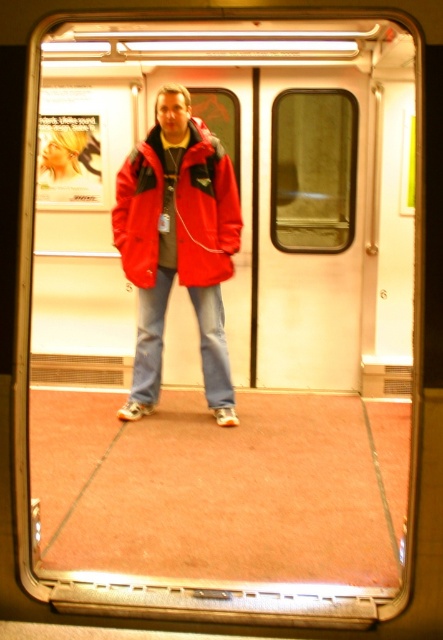
You are a passenger on the subway and want to exit through the white matte door at center. You are currently standing near the matte nylon jacket at center. Can you walk directly to the door without moving around any obstacles?

The white matte door at center is further to the viewer than the matte nylon jacket at center, meaning the door is closer to you. Since you are already at the same position as the jacket, you can walk directly to the door without needing to move around obstacles.

You are standing outside the subway car and want to enter through the white matte door at center. Based on the coordinates provided, is the door located closer to the front or the back of the subway car?

The white matte door at center is located at coordinates point (310, 227). Since the coordinate system typically places (0, 0) at the bottom left corner, the door is closer to the front of the subway car.

You are a passenger on the subway and need to exit through the white matte door at center. You are wearing a bulky matte nylon jacket at center. Will the door opening be wide enough for you to pass through comfortably?

The white matte door at center is thinner than the matte nylon jacket at center, so the door opening may not be wide enough for you to pass through comfortably while wearing the bulky jacket.